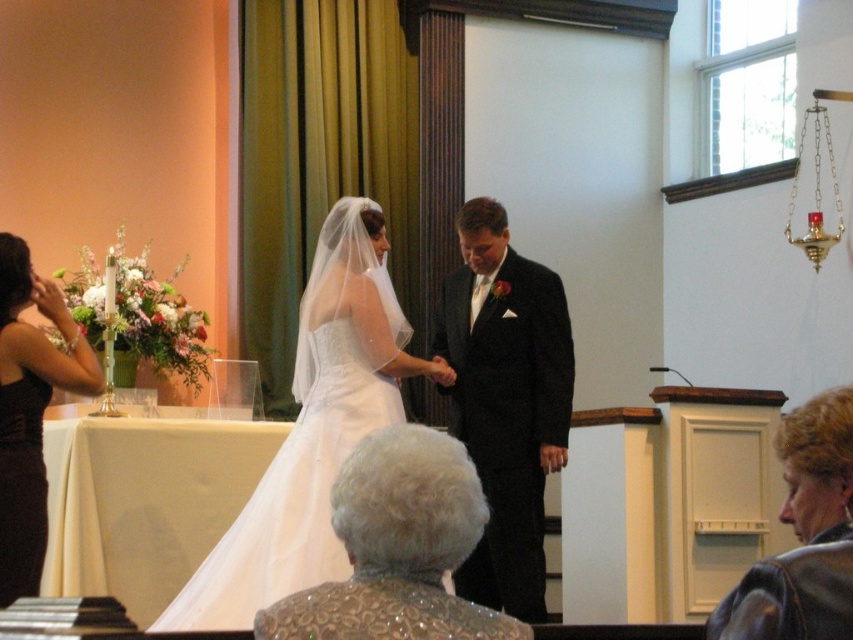
Question: Is white satin dress at center smaller than black satin suit at center?

Choices:
 (A) no
 (B) yes

Answer: (A)

Question: Which point is closer to the camera taking this photo?

Choices:
 (A) (514, 573)
 (B) (3, 593)
 (C) (247, 572)

Answer: (B)

Question: Which of the following is the closest to the observer?

Choices:
 (A) (241, 513)
 (B) (467, 346)

Answer: (A)

Question: Is black satin suit at center smaller than black satin dress at left?

Choices:
 (A) yes
 (B) no

Answer: (B)

Question: Among these points, which one is nearest to the camera?

Choices:
 (A) (325, 404)
 (B) (514, 600)
 (C) (28, 381)

Answer: (C)

Question: Does white satin dress at center have a smaller size compared to black satin suit at center?

Choices:
 (A) no
 (B) yes

Answer: (A)